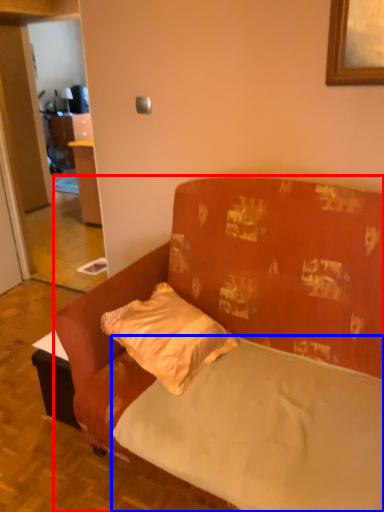
Question: Which of the following is the farthest to the observer, studio couch (highlighted by a red box) or mattress (highlighted by a blue box)?

Choices:
 (A) studio couch
 (B) mattress

Answer: (B)